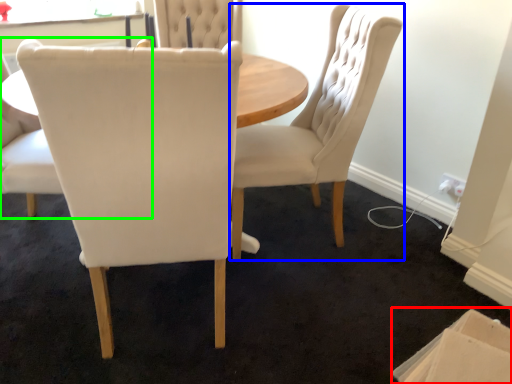
Question: Which object is the farthest from cardboard box (highlighted by a red box)? Choose among these: chair (highlighted by a blue box) or chair (highlighted by a green box).

Choices:
 (A) chair
 (B) chair

Answer: (B)